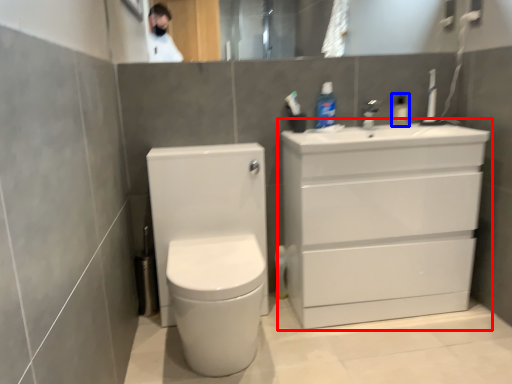
Question: Which of the following is the closest to the observer, bathroom cabinet (highlighted by a red box) or toiletry (highlighted by a blue box)?

Choices:
 (A) bathroom cabinet
 (B) toiletry

Answer: (A)